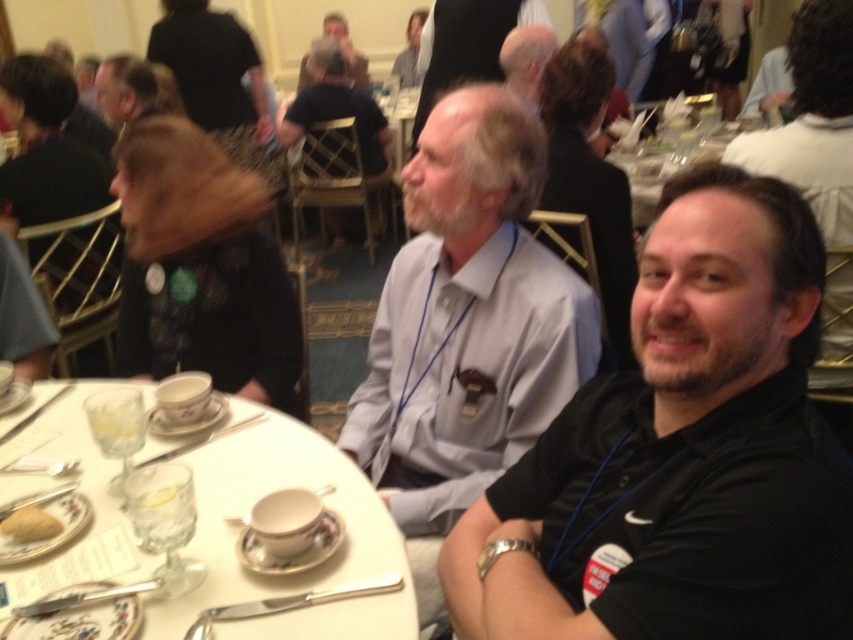
Which of these two, white porcelain table at center or matte black hair at upper center, stands shorter?

white porcelain table at center

Consider the image. Can you confirm if white porcelain table at center is thinner than matte black hair at upper center?

In fact, white porcelain table at center might be wider than matte black hair at upper center.

Is point (663, 177) positioned before point (337, 17)?

Yes, it is.

Locate an element on the screen. The width and height of the screenshot is (853, 640). white porcelain table at center is located at coordinates (669, 161).

Between golden brown bread at lower left and white porcelain saucer at lower left, which one is positioned higher?

white porcelain saucer at lower left is above.

Is golden brown bread at lower left in front of white porcelain saucer at lower left?

No.

Is point (33, 513) positioned in front of point (169, 492)?

That is False.

The width and height of the screenshot is (853, 640). Find the location of `golden brown bread at lower left`. golden brown bread at lower left is located at coordinates (30, 524).

Is black shirt at center smaller than light blue shirt at center?

Indeed, black shirt at center has a smaller size compared to light blue shirt at center.

Does black shirt at center appear on the right side of light blue shirt at center?

Yes, black shirt at center is to the right of light blue shirt at center.

Measure the distance between point (532, 636) and camera.

Point (532, 636) is 82.53 centimeters away from camera.

Locate an element on the screen. black shirt at center is located at coordinates (680, 452).